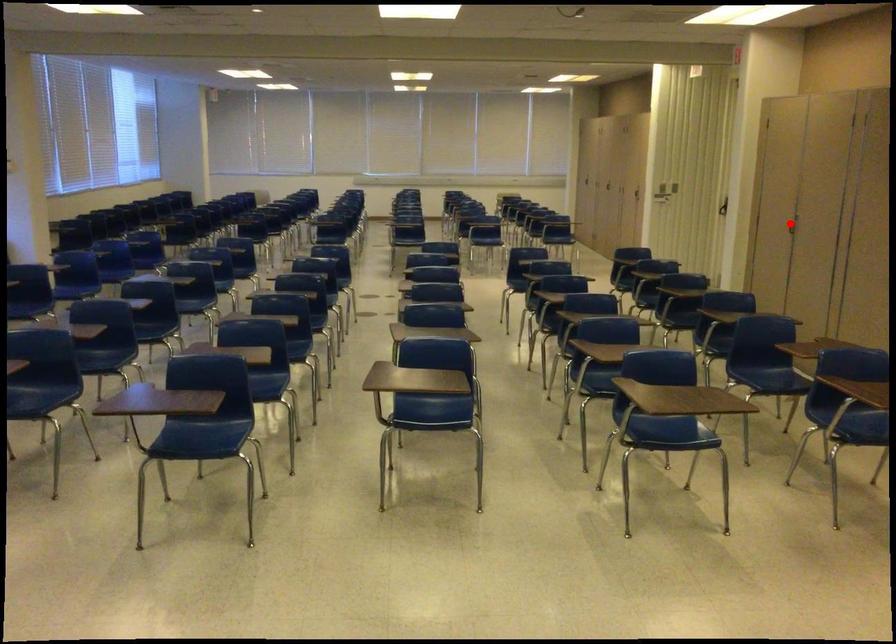
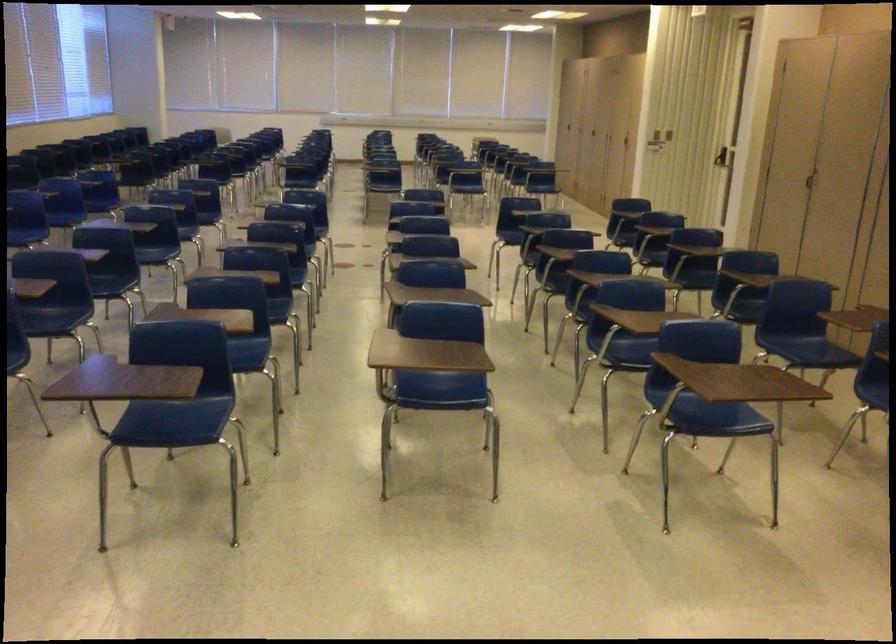
In the second image, find the point that corresponds to the highlighted location in the first image.

(808, 180)